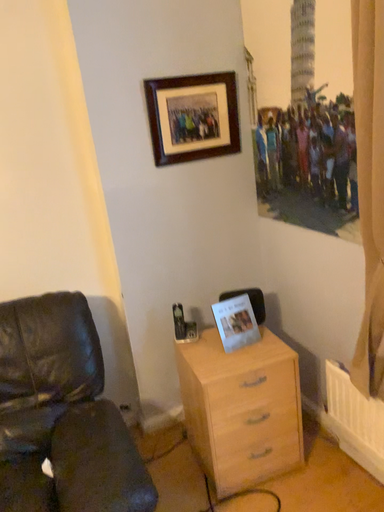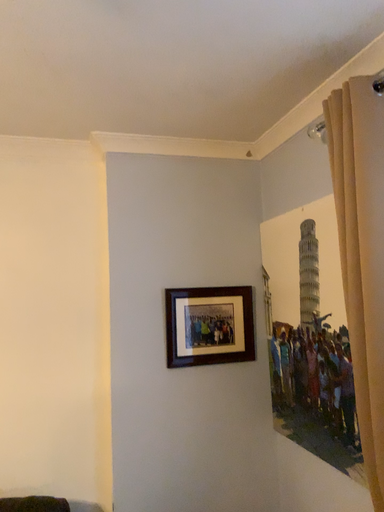
Question: Which way did the camera rotate in the video?

Choices:
 (A) rotated downward
 (B) rotated upward

Answer: (B)